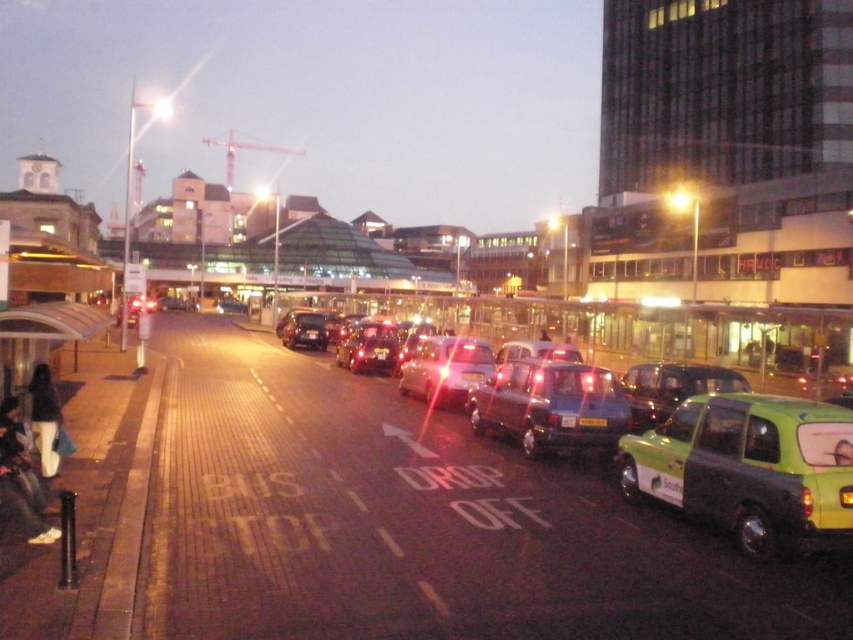
Question: Which object is positioned closest to the metallic green taxi at center?

Choices:
 (A) white pants at lower left
 (B) metallic gray taxi at center
 (C) metallic blue taxi at center
 (D) black plastic license plate at center

Answer: (C)

Question: Which object is closer to the camera taking this photo?

Choices:
 (A) green matte taxi at center
 (B) metallic green taxi at center
 (C) metallic gray taxi at center

Answer: (C)

Question: Which point is closer to the camera taking this photo?

Choices:
 (A) (33, 385)
 (B) (735, 440)

Answer: (B)

Question: Does metallic green taxi at center have a larger size compared to black plastic license plate at center?

Choices:
 (A) no
 (B) yes

Answer: (B)

Question: Observing the image, what is the correct spatial positioning of metallic blue taxi at center in reference to metallic green taxi at center?

Choices:
 (A) left
 (B) right

Answer: (B)

Question: Does green matte taxi at right come behind metallic blue taxi at center?

Choices:
 (A) yes
 (B) no

Answer: (B)